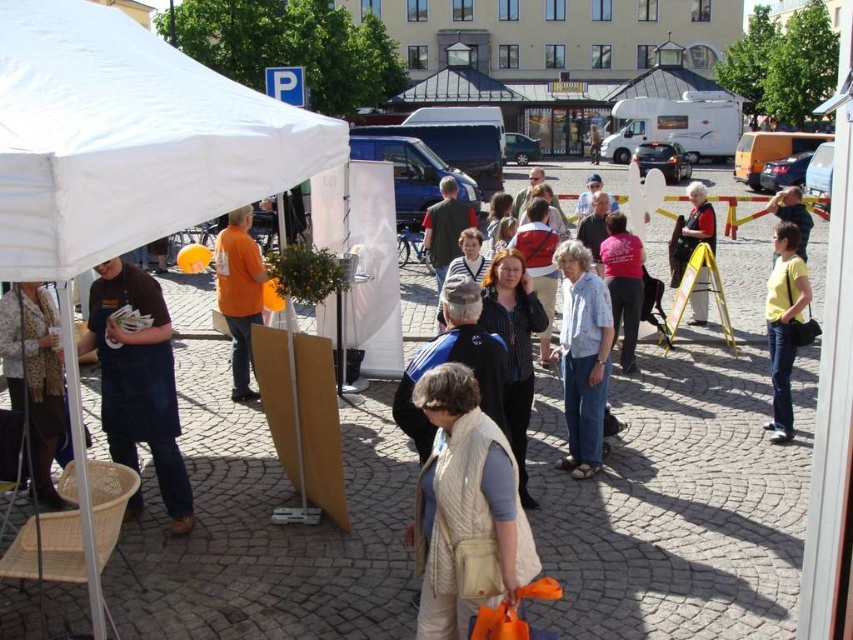
Does brown apron at left have a larger size compared to leopard print scarf at lower left?

Correct, brown apron at left is larger in size than leopard print scarf at lower left.

Between point (137, 342) and point (55, 497), which one is positioned in front?

Positioned in front is point (137, 342).

Which is in front, point (160, 484) or point (4, 328)?

Positioned in front is point (4, 328).

Locate an element on the screen. The width and height of the screenshot is (853, 640). brown apron at left is located at coordinates (137, 378).

Is point (38, 45) closer to camera compared to point (694, 180)?

Yes, point (38, 45) is in front of point (694, 180).

Does white fabric canopy at upper left have a lesser width compared to matte black jacket at center?

Yes.

Is point (308, 157) closer to camera compared to point (677, 268)?

Yes.

At what (x,y) coordinates should I click in order to perform the action: click on white fabric canopy at upper left. Please return your answer as a coordinate pair (x, y). Looking at the image, I should click on (126, 140).

Is brown apron at left below orange fabric bag at center?

Yes, brown apron at left is below orange fabric bag at center.

Between brown apron at left and orange fabric bag at center, which one is positioned lower?

brown apron at left is below.

You are a GUI agent. You are given a task and a screenshot of the screen. Output one action in this format:
    pyautogui.click(x=<x>, y=<y>)
    Task: Click on the brown apron at left
    
    Given the screenshot: What is the action you would take?
    pyautogui.click(x=137, y=378)

Locate an element on the screen. brown apron at left is located at coordinates click(x=137, y=378).